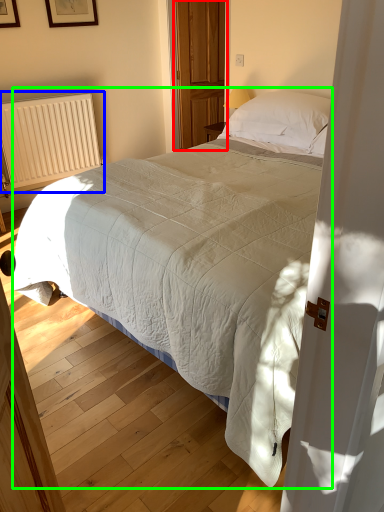
Question: Based on their relative distances, which object is farther from screen door (highlighted by a red box)? Choose from radiator (highlighted by a blue box) and bed (highlighted by a green box).

Choices:
 (A) radiator
 (B) bed

Answer: (B)